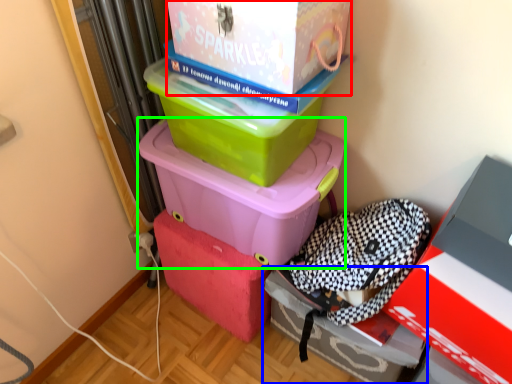
Question: Which object is positioned closest to box (highlighted by a red box)? Select from box (highlighted by a blue box) and box (highlighted by a green box).

Choices:
 (A) box
 (B) box

Answer: (B)